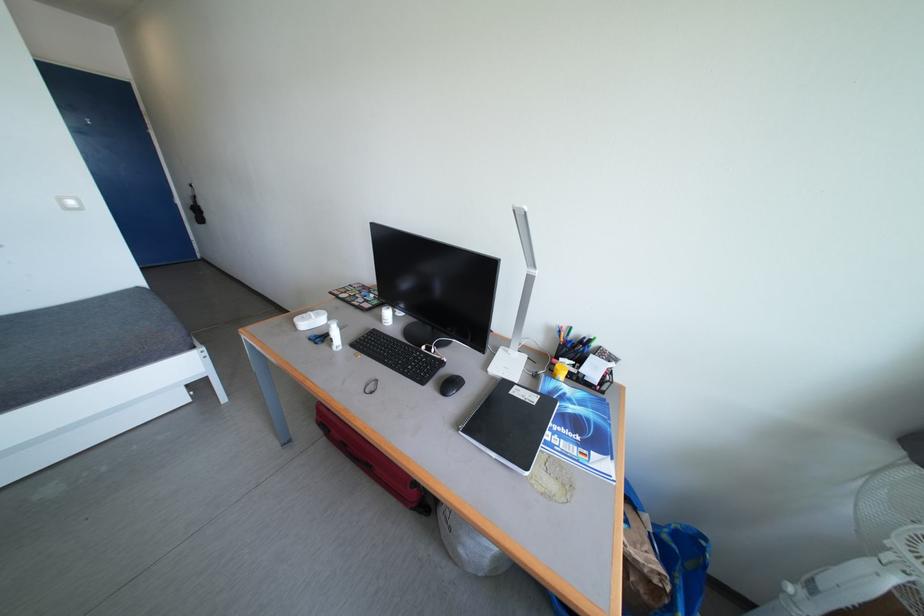
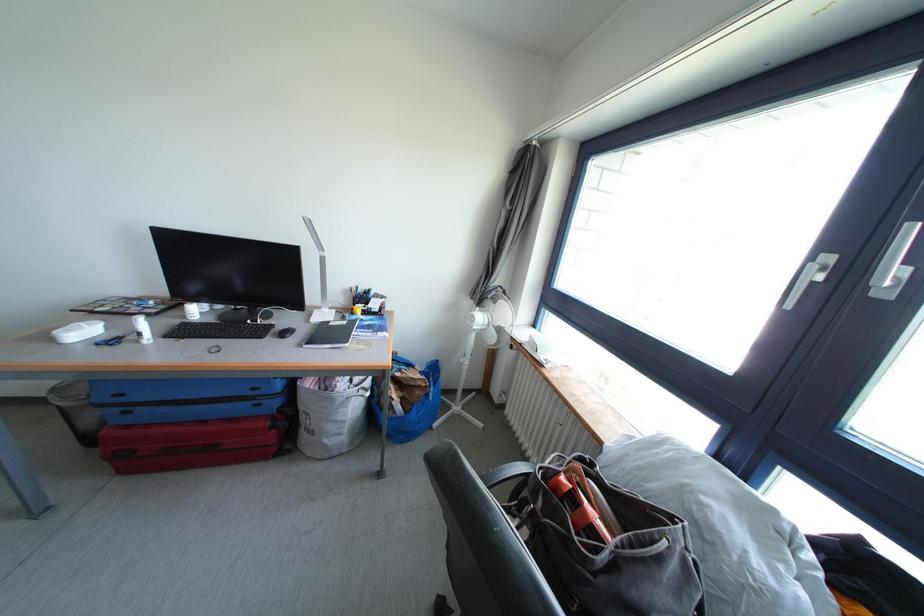
Find the pixel in the second image that matches point 499,383 in the first image.

(322, 329)